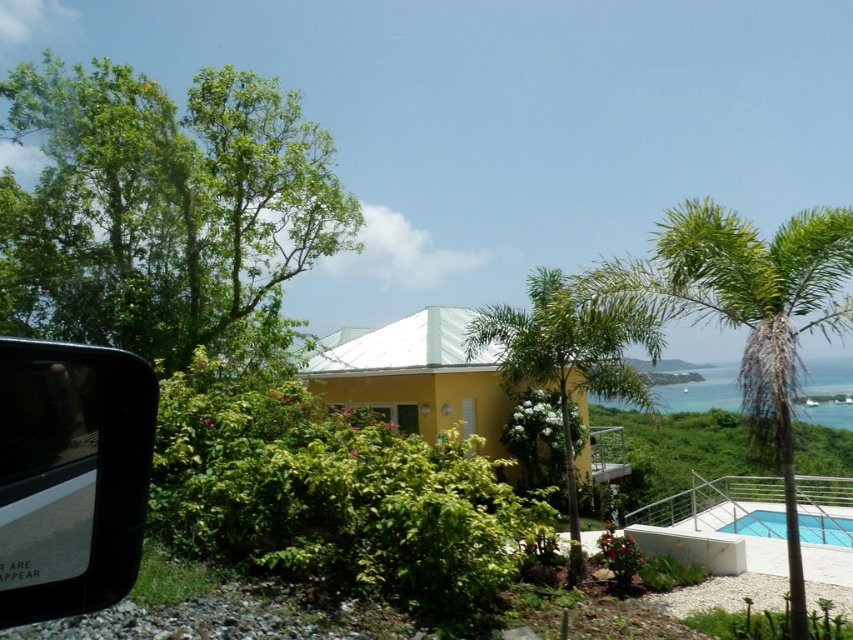
Question: Among these objects, which one is farthest from the camera?

Choices:
 (A) transparent glass car window at lower left
 (B) green leafy palm tree at upper right
 (C) green leafy palm tree at center

Answer: (C)

Question: Which is nearer to the green leafy tree at upper left?

Choices:
 (A) green leafy palm tree at upper right
 (B) green leafy palm tree at center

Answer: (B)

Question: Is transparent glass car window at lower left positioned before green leafy palm tree at upper right?

Choices:
 (A) no
 (B) yes

Answer: (B)

Question: Does green leafy tree at upper left lie in front of transparent glass car window at lower left?

Choices:
 (A) yes
 (B) no

Answer: (B)

Question: Does transparent glass car window at lower left appear on the left side of green leafy palm tree at upper right?

Choices:
 (A) no
 (B) yes

Answer: (B)

Question: Considering the real-world distances, which object is farthest from the green leafy tree at upper left?

Choices:
 (A) green leafy palm tree at upper right
 (B) green leafy palm tree at center

Answer: (A)